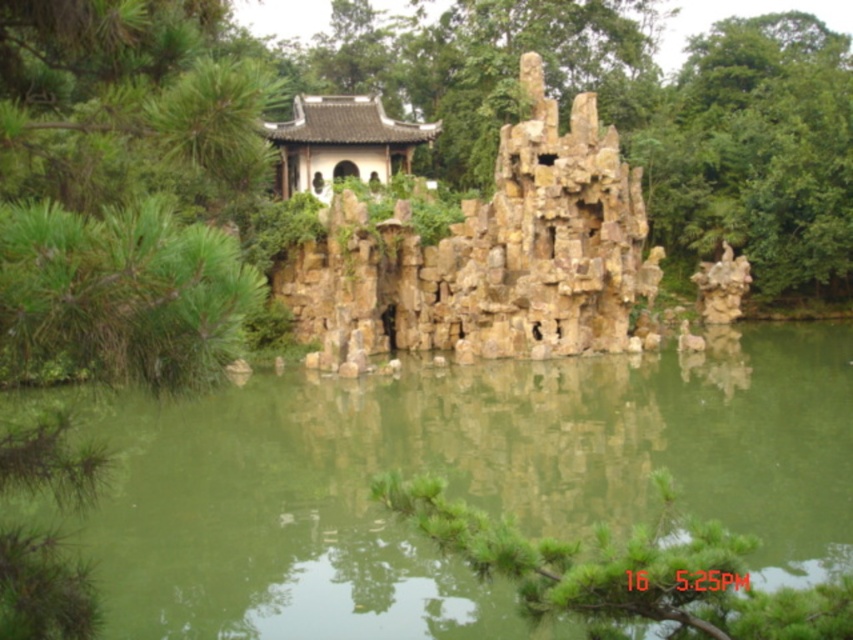
Question: Does green leafy tree at left appear under green needle-like leaves at lower center?

Choices:
 (A) no
 (B) yes

Answer: (A)

Question: Which object appears farthest from the camera in this image?

Choices:
 (A) yellowish stone rock formation at center
 (B) green needle-like leaves at lower center

Answer: (A)

Question: Estimate the real-world distances between objects in this image. Which object is closer to the yellowish stone rock formation at center?

Choices:
 (A) green needle-like leaves at lower center
 (B) green leafy tree at left
 (C) green stone lake at center

Answer: (C)

Question: Which point appears closest to the camera in this image?

Choices:
 (A) (308, 298)
 (B) (424, 612)
 (C) (120, 381)

Answer: (C)

Question: Is green stone lake at center below green leafy tree at left?

Choices:
 (A) yes
 (B) no

Answer: (A)

Question: Is green leafy tree at left to the left of green needle-like leaves at lower center from the viewer's perspective?

Choices:
 (A) no
 (B) yes

Answer: (B)